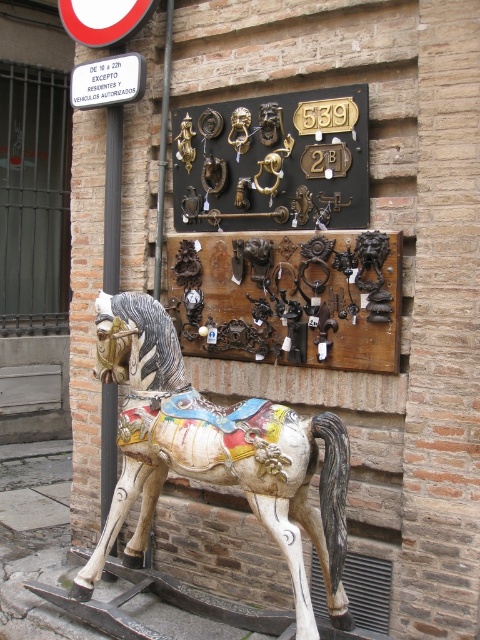
You are standing in the street scene and want to locate two specific points marked on the image. The first point is at coordinates point [107,504] and the second is at point [70,99]. Which point is closer to you?

Point [107,504] is in front of point [70,99], so it is closer to you.

You are a painter standing at the base of the brick wall. You need to paint a white plastic sign at upper left that is 10 inches away from a black metal pole at left. Can you safely paint the sign without getting paint on the pole?

The distance between the black metal pole at left and the white plastic sign at upper left is 10.68 inches, which is slightly more than 10 inches. Therefore, you can safely paint the sign without getting paint on the pole.